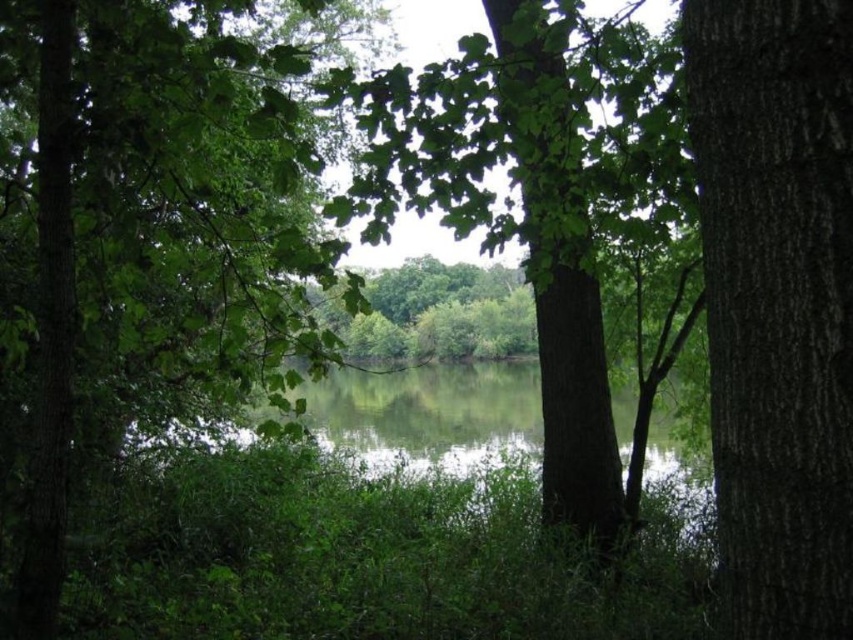
Is green leafy tree at center below green rough bark tree at center?

Yes.

From the picture: Is green leafy tree at center wider than green rough bark tree at center?

No, green leafy tree at center is not wider than green rough bark tree at center.

Which is in front, point (163, 221) or point (567, 272)?

Positioned in front is point (163, 221).

This screenshot has height=640, width=853. Find the location of `green leafy tree at center`. green leafy tree at center is located at coordinates (x=155, y=256).

Does smooth bark tree at right appear over green rough bark tree at center?

No.

Identify the location of smooth bark tree at right. This screenshot has height=640, width=853. (776, 301).

Who is more distant from viewer, (759, 188) or (538, 316)?

The point (538, 316) is behind.

What are the coordinates of `smooth bark tree at right` in the screenshot? It's located at (x=776, y=301).

Does point (22, 630) come behind point (708, 275)?

Yes, it is.

Which is more to the right, green leafy tree at center or smooth bark tree at right?

smooth bark tree at right

Does point (91, 170) come in front of point (723, 486)?

No.

At what (x,y) coordinates should I click in order to perform the action: click on green leafy tree at center. Please return your answer as a coordinate pair (x, y). Looking at the image, I should click on point(155,256).